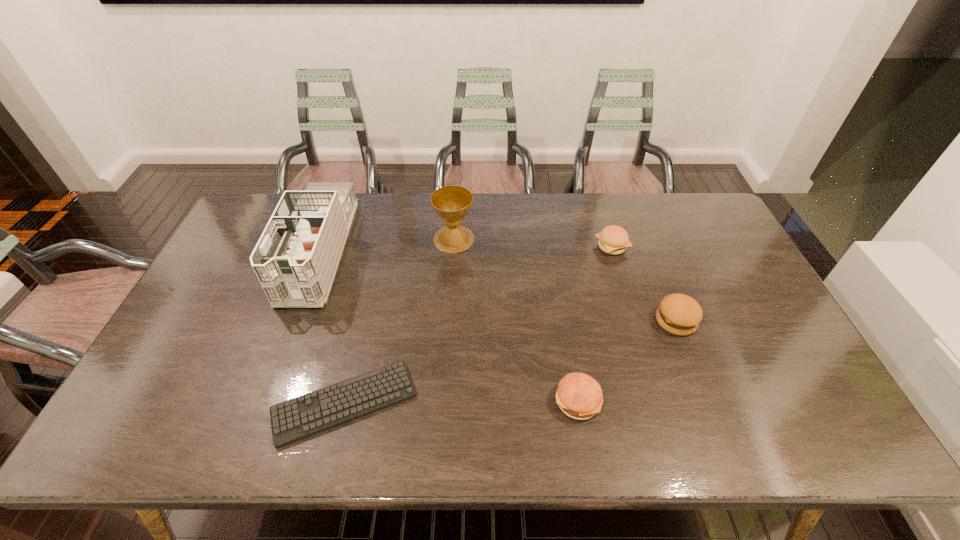
In order to click on vacant space situated 0.350m on the front of the chalice in this screenshot , I will do tap(447, 342).

Locate an element on the screen. vacant position located 0.070m on the front of the fifth object from left to right is located at coordinates (620, 274).

At what (x,y) coordinates should I click in order to perform the action: click on vacant space situated on the right of the rightmost hamburger. Please return your answer as a coordinate pair (x, y). Looking at the image, I should click on (763, 321).

Where is `vacant region located on the left of the leftmost hamburger`? The image size is (960, 540). vacant region located on the left of the leftmost hamburger is located at coordinates (419, 401).

Find the location of `blank area located 0.190m on the back of the shortest object`. blank area located 0.190m on the back of the shortest object is located at coordinates (367, 307).

Identify the location of dollhouse that is at the far edge. The width and height of the screenshot is (960, 540). (295, 260).

At what (x,y) coordinates should I click in order to perform the action: click on chalice at the far edge. Please return your answer as a coordinate pair (x, y). The height and width of the screenshot is (540, 960). Looking at the image, I should click on (451, 203).

Image resolution: width=960 pixels, height=540 pixels. I want to click on hamburger that is at the near edge, so [579, 396].

You are a GUI agent. You are given a task and a screenshot of the screen. Output one action in this format:
    pyautogui.click(x=<x>, y=<y>)
    Task: Click on the computer keyboard at the near edge
    This screenshot has height=540, width=960.
    Given the screenshot: What is the action you would take?
    pyautogui.click(x=312, y=413)

You are a GUI agent. You are given a task and a screenshot of the screen. Output one action in this format:
    pyautogui.click(x=<x>, y=<y>)
    Task: Click on the vacant space at the far edge of the desktop
    Image resolution: width=960 pixels, height=540 pixels.
    Given the screenshot: What is the action you would take?
    pyautogui.click(x=422, y=194)